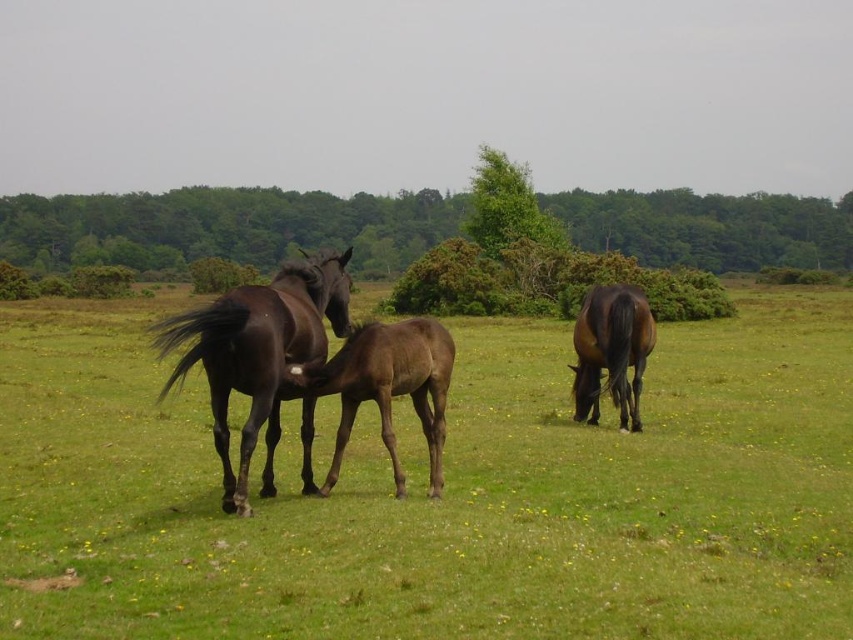
Which is behind, point (76, 384) or point (239, 460)?

Point (76, 384)

Find the location of a particular element. The width and height of the screenshot is (853, 640). brown glossy horse at center is located at coordinates (444, 493).

Which of these two, shiny dark brown horse at center or shiny brown horse at right, stands taller?

Standing taller between the two is shiny brown horse at right.

Which is more to the right, shiny dark brown horse at center or shiny brown horse at right?

shiny brown horse at right

Describe the element at coordinates (257, 353) in the screenshot. The height and width of the screenshot is (640, 853). I see `shiny dark brown horse at center` at that location.

What are the coordinates of `shiny dark brown horse at center` in the screenshot? It's located at (257, 353).

Between point (204, 355) and point (431, 360), which one is positioned behind?

The point (431, 360) is behind.

Image resolution: width=853 pixels, height=640 pixels. Describe the element at coordinates (257, 353) in the screenshot. I see `shiny dark brown horse at center` at that location.

What are the coordinates of `shiny dark brown horse at center` in the screenshot? It's located at (257, 353).